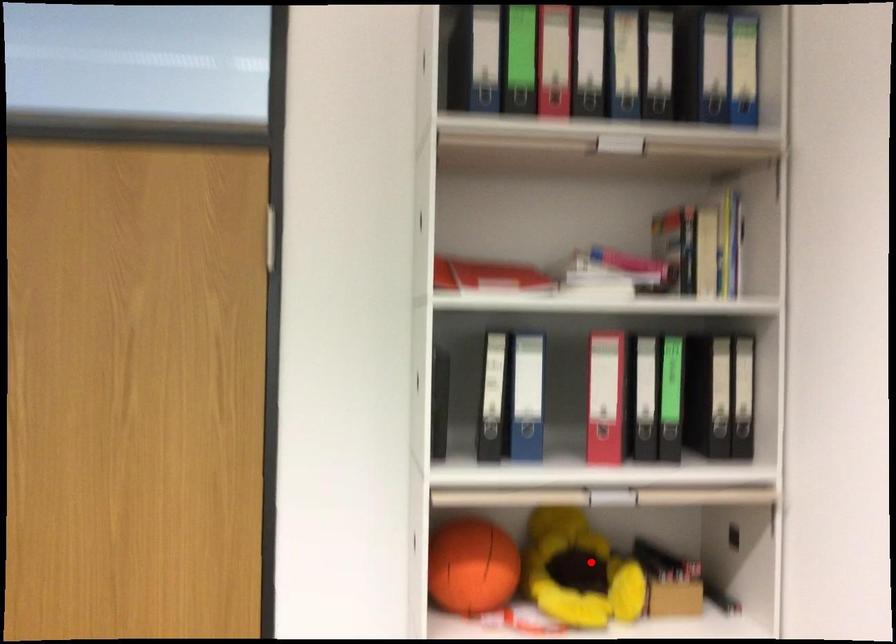
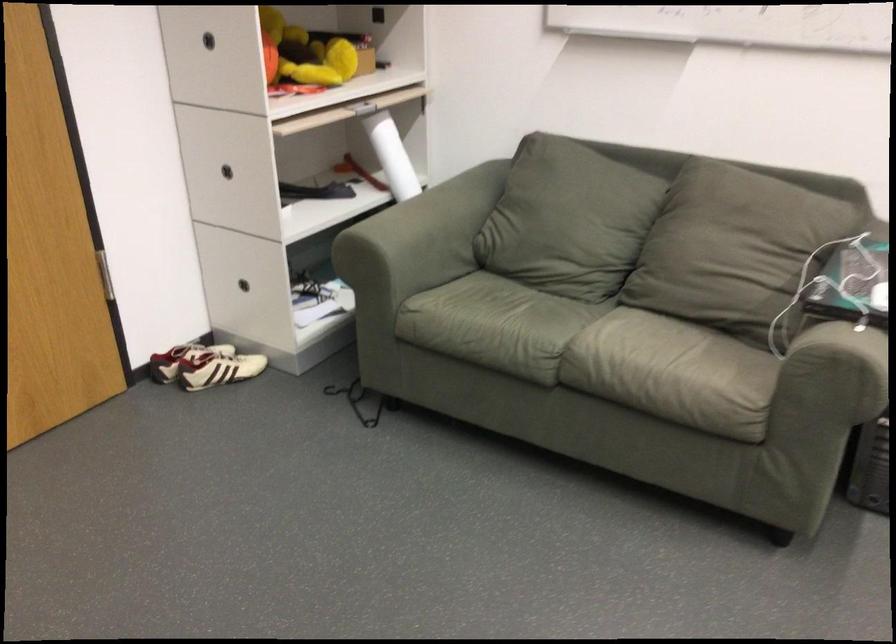
In the second image, find the point that corresponds to the highlighted location in the first image.

(303, 53)